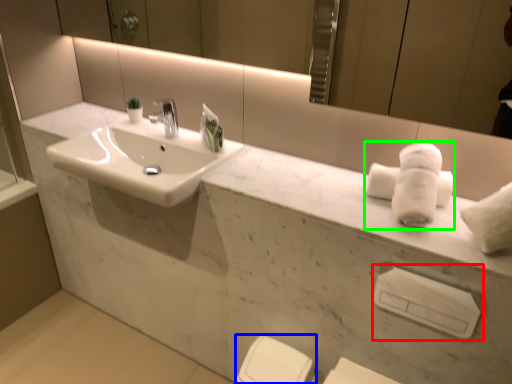
Question: Considering the real-world distances, which object is farthest from towel bar (highlighted by a red box)? porcelain (highlighted by a blue box) or bath towel (highlighted by a green box)?

Choices:
 (A) porcelain
 (B) bath towel

Answer: (A)